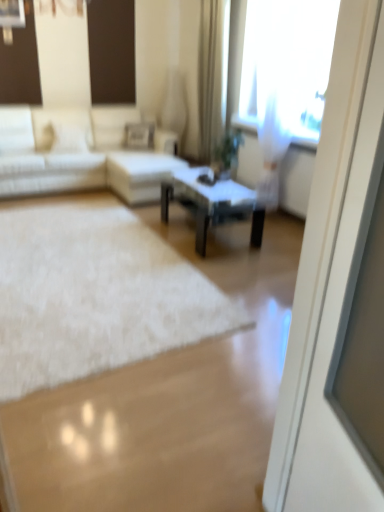
Question: From the image's perspective, is white fabric couch at left located above transparent curtain at upper right?

Choices:
 (A) yes
 (B) no

Answer: (B)

Question: Does white fabric couch at left have a smaller size compared to transparent curtain at upper right?

Choices:
 (A) no
 (B) yes

Answer: (A)

Question: Would you consider white fabric couch at left to be distant from transparent curtain at upper right?

Choices:
 (A) yes
 (B) no

Answer: (A)

Question: Is white fabric couch at left outside of transparent curtain at upper right?

Choices:
 (A) no
 (B) yes

Answer: (B)

Question: Does white fabric couch at left have a greater height compared to transparent curtain at upper right?

Choices:
 (A) yes
 (B) no

Answer: (B)

Question: Is white fabric couch at left thinner than transparent curtain at upper right?

Choices:
 (A) no
 (B) yes

Answer: (A)

Question: From the image's perspective, does transparent curtain at upper right appear lower than white fabric couch at left?

Choices:
 (A) no
 (B) yes

Answer: (A)

Question: Is transparent curtain at upper right positioned behind white fabric couch at left?

Choices:
 (A) no
 (B) yes

Answer: (A)

Question: From a real-world perspective, is transparent curtain at upper right on top of white fabric couch at left?

Choices:
 (A) yes
 (B) no

Answer: (A)

Question: Is transparent curtain at upper right positioned in front of white fabric couch at left?

Choices:
 (A) yes
 (B) no

Answer: (A)

Question: Is transparent curtain at upper right bigger than white fabric couch at left?

Choices:
 (A) yes
 (B) no

Answer: (B)

Question: Does transparent curtain at upper right have a smaller size compared to white fabric couch at left?

Choices:
 (A) yes
 (B) no

Answer: (A)

Question: Is white fabric couch at left at the back of white glossy screen door at right?

Choices:
 (A) no
 (B) yes

Answer: (A)